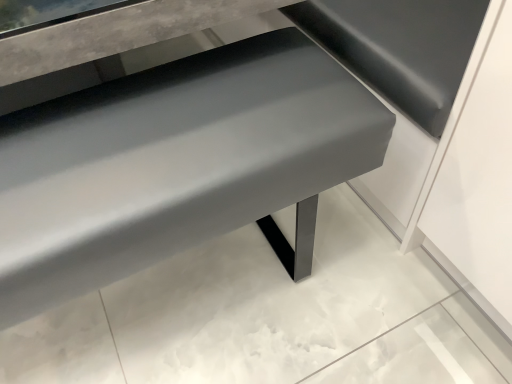
What do you see at coordinates (177, 165) in the screenshot?
I see `matte gray bench at center` at bounding box center [177, 165].

The width and height of the screenshot is (512, 384). Find the location of `matte gray bench at center`. matte gray bench at center is located at coordinates (177, 165).

The image size is (512, 384). What are the coordinates of `matte gray bench at center` in the screenshot? It's located at (177, 165).